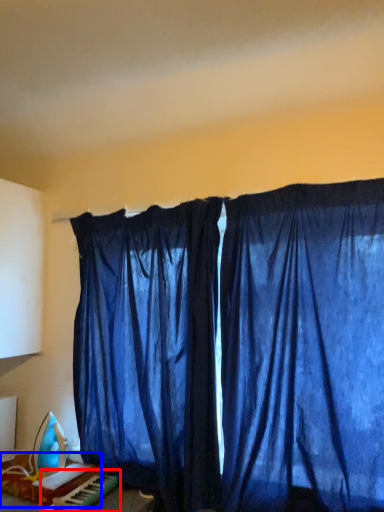
Question: Which point is further to the camera, musical keyboard (highlighted by a red box) or furniture (highlighted by a blue box)?

Choices:
 (A) musical keyboard
 (B) furniture

Answer: (B)